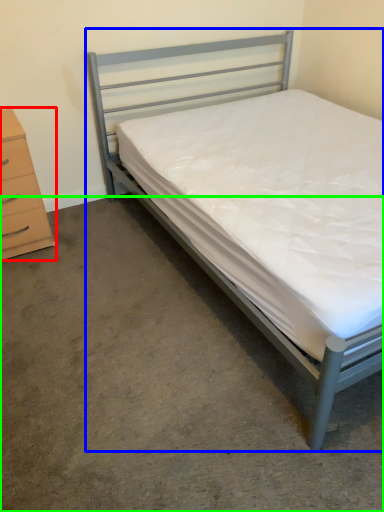
Question: Considering the real-world distances, which object is farthest from chest of drawers (highlighted by a red box)? bed (highlighted by a blue box) or concrete (highlighted by a green box)?

Choices:
 (A) bed
 (B) concrete

Answer: (B)